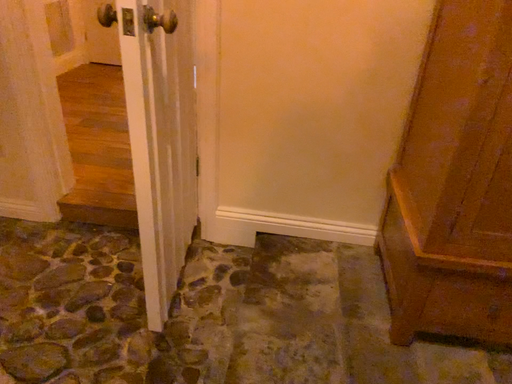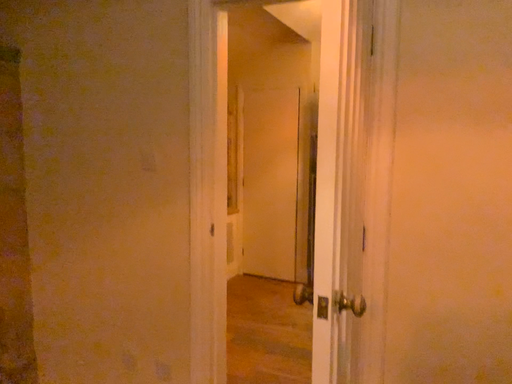
Question: Which way did the camera rotate in the video?

Choices:
 (A) rotated right
 (B) rotated left

Answer: (B)